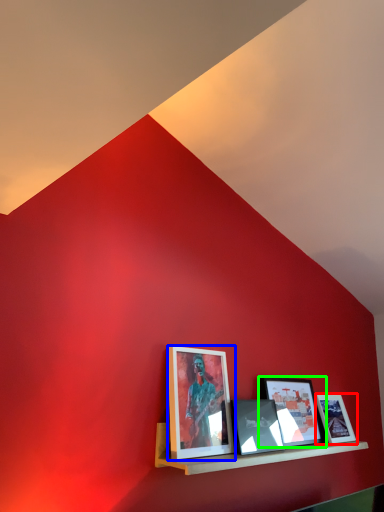
Question: Which is nearer to the picture frame (highlighted by a red box)? picture frame (highlighted by a blue box) or picture frame (highlighted by a green box).

Choices:
 (A) picture frame
 (B) picture frame

Answer: (B)